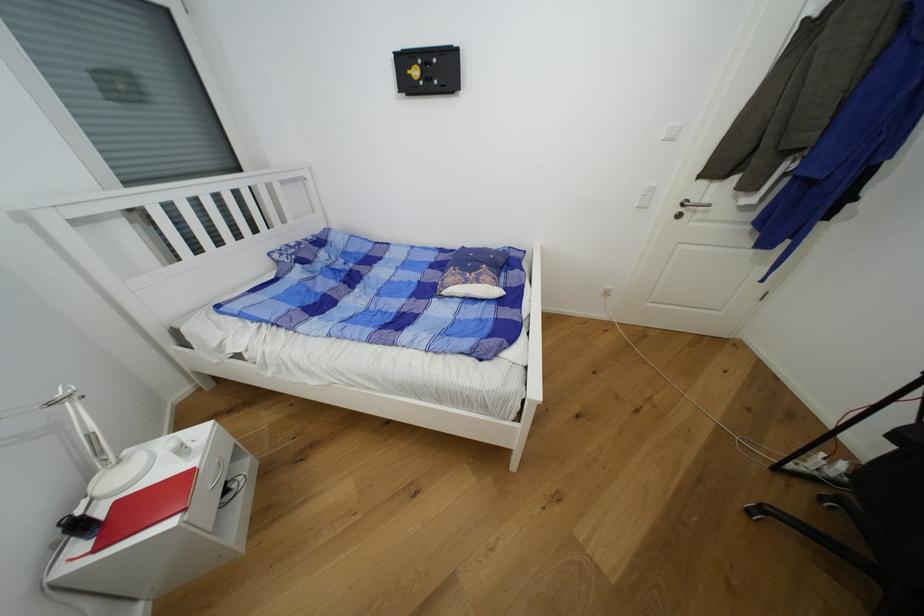
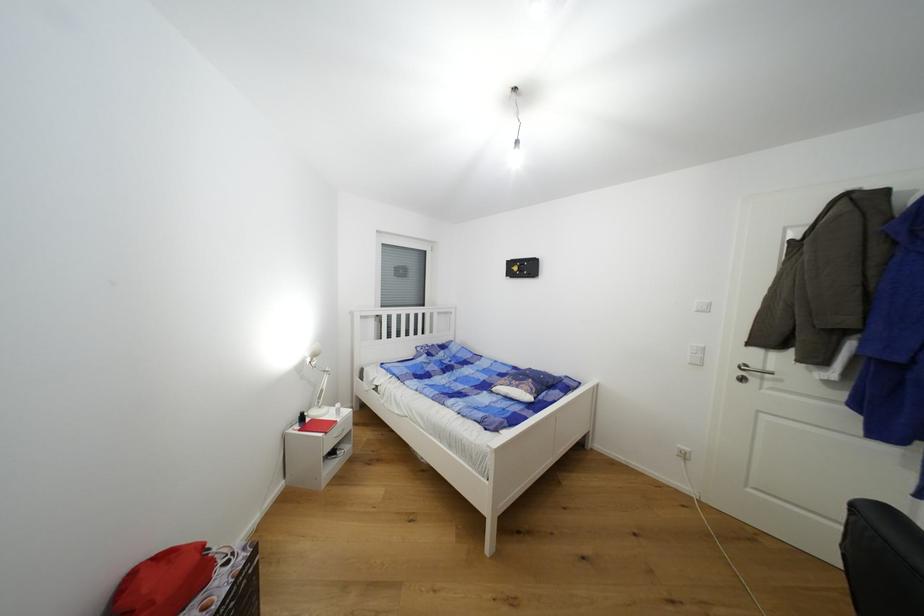
The images are taken continuously from a first-person perspective. In which direction is your viewpoint rotating?

The rotation direction of the camera is left-up.